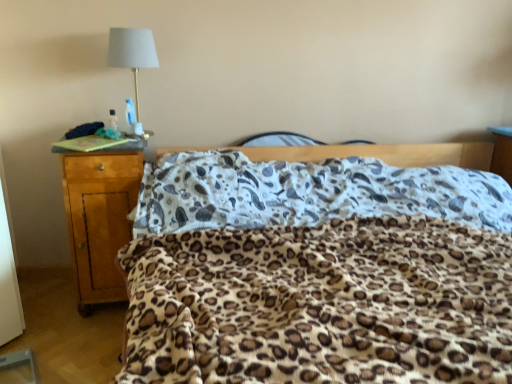
Question: Does light brown wood nightstand at left have a smaller size compared to leopard print blanket at center?

Choices:
 (A) yes
 (B) no

Answer: (A)

Question: Is light brown wood nightstand at left next to leopard print blanket at center and touching it?

Choices:
 (A) yes
 (B) no

Answer: (B)

Question: From the image's perspective, is light brown wood nightstand at left located above leopard print blanket at center?

Choices:
 (A) yes
 (B) no

Answer: (A)

Question: From the image's perspective, would you say light brown wood nightstand at left is shown under leopard print blanket at center?

Choices:
 (A) yes
 (B) no

Answer: (B)

Question: Can we say light brown wood nightstand at left lies outside leopard print blanket at center?

Choices:
 (A) no
 (B) yes

Answer: (B)

Question: Is light brown wood nightstand at left further to the viewer compared to leopard print blanket at center?

Choices:
 (A) no
 (B) yes

Answer: (B)

Question: Is white fabric lampshade at upper left bigger than light brown wood nightstand at left?

Choices:
 (A) yes
 (B) no

Answer: (B)

Question: Can you confirm if white fabric lampshade at upper left is positioned to the left of light brown wood nightstand at left?

Choices:
 (A) no
 (B) yes

Answer: (A)

Question: Is white fabric lampshade at upper left with light brown wood nightstand at left?

Choices:
 (A) no
 (B) yes

Answer: (A)

Question: From a real-world perspective, is white fabric lampshade at upper left positioned under light brown wood nightstand at left based on gravity?

Choices:
 (A) yes
 (B) no

Answer: (B)

Question: From the image's perspective, does white fabric lampshade at upper left appear lower than light brown wood nightstand at left?

Choices:
 (A) no
 (B) yes

Answer: (A)

Question: Is light brown wood nightstand at left at the back of white fabric lampshade at upper left?

Choices:
 (A) yes
 (B) no

Answer: (B)

Question: Does light brown wood nightstand at left have a lesser height compared to white fabric lampshade at upper left?

Choices:
 (A) yes
 (B) no

Answer: (B)